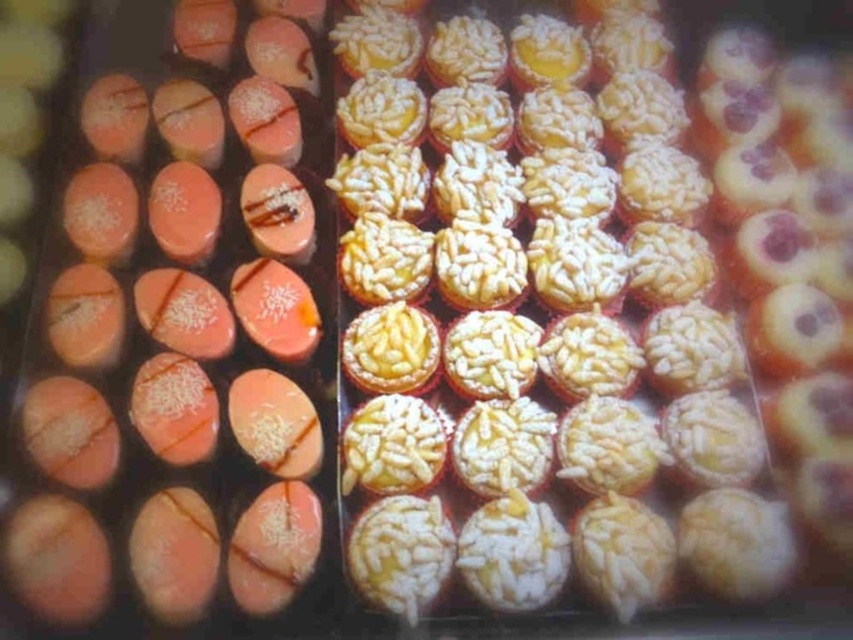
Is white sugary cupcake at center smaller than matte pink chocolate at center?

A: No, white sugary cupcake at center is not smaller than matte pink chocolate at center.

Can you confirm if white sugary cupcake at center is bigger than matte pink chocolate at center?

Yes.

Find the location of a particular element. Image resolution: width=853 pixels, height=640 pixels. white sugary cupcake at center is located at coordinates (535, 324).